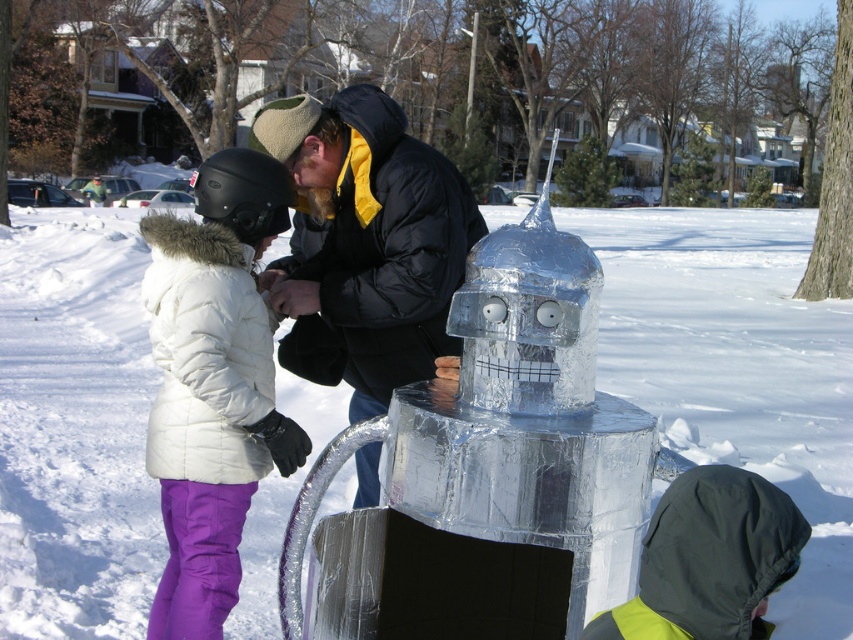
You are a photographer trying to capture the shiny metallic robot at center in your shot. The camera is set up at the bottom left corner of the image. What direction should you move the camera to get the robot into the frame?

Since the shiny metallic robot at center is located at point (737, 368), you should move the camera upwards and to the right to position the robot within the frame.